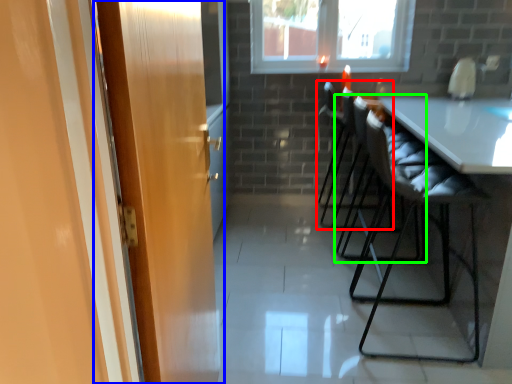
Question: Considering the real-world distances, which object is farthest from chair (highlighted by a red box)? door (highlighted by a blue box) or chair (highlighted by a green box)?

Choices:
 (A) door
 (B) chair

Answer: (A)